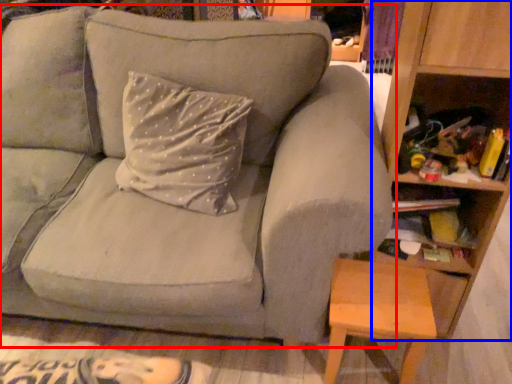
Question: Which of the following is the closest to the observer, studio couch (highlighted by a red box) or bookshelf (highlighted by a blue box)?

Choices:
 (A) studio couch
 (B) bookshelf

Answer: (A)